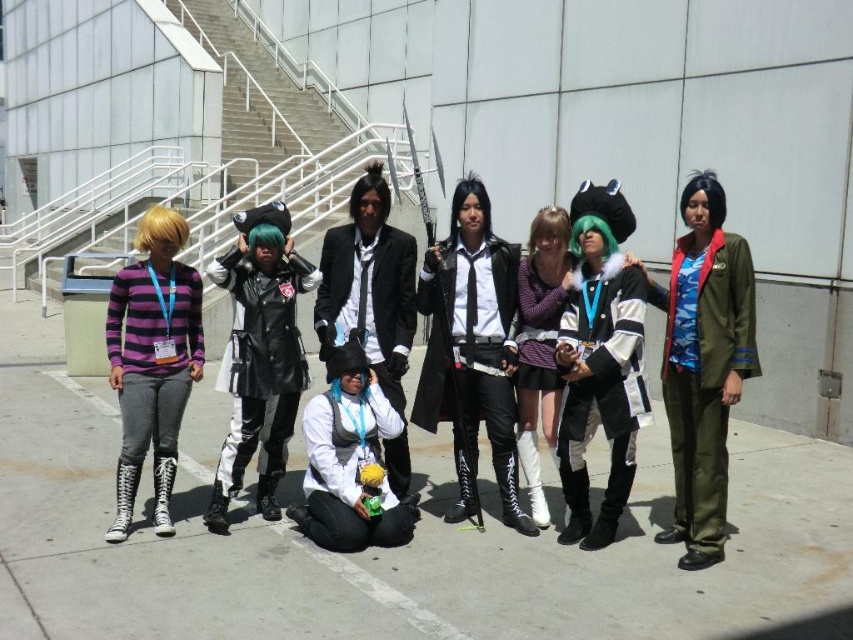
Does matte purple sweater at center appear over black leather jacket at center?

No, matte purple sweater at center is not above black leather jacket at center.

Who is positioned more to the left, matte purple sweater at center or black leather jacket at center?

From the viewer's perspective, black leather jacket at center appears more on the left side.

This screenshot has height=640, width=853. What do you see at coordinates (540, 346) in the screenshot? I see `matte purple sweater at center` at bounding box center [540, 346].

You are a GUI agent. You are given a task and a screenshot of the screen. Output one action in this format:
    pyautogui.click(x=<x>, y=<y>)
    Task: Click on the matte purple sweater at center
    The width and height of the screenshot is (853, 640).
    Given the screenshot: What is the action you would take?
    pyautogui.click(x=540, y=346)

Who is taller, leather jacket at center or camouflage fabric jacket at right?

camouflage fabric jacket at right

Which is behind, point (276, 433) or point (735, 268)?

Point (276, 433)

The image size is (853, 640). Find the location of `leather jacket at center`. leather jacket at center is located at coordinates (260, 358).

Which is above, matte purple sweater at center or purple striped sweater at center?

purple striped sweater at center

Is point (553, 211) positioned behind point (532, 323)?

No, it is not.

The image size is (853, 640). I want to click on matte purple sweater at center, so click(x=540, y=346).